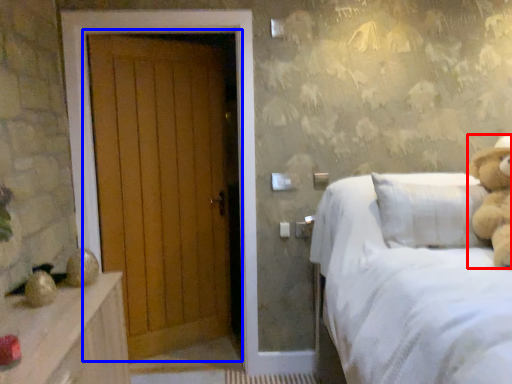
Question: Among these objects, which one is farthest to the camera, teddy bear (highlighted by a red box) or door (highlighted by a blue box)?

Choices:
 (A) teddy bear
 (B) door

Answer: (B)